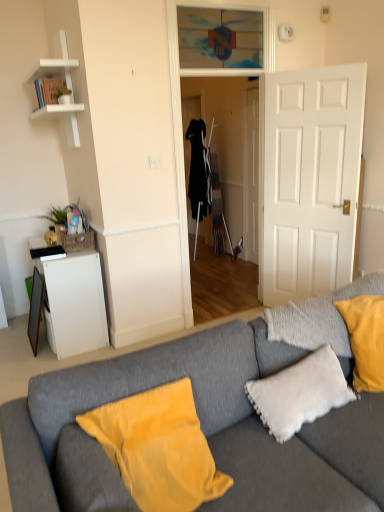
Question: Is transparent glass door at center to the left of transparent glass door at upper center from the viewer's perspective?

Choices:
 (A) no
 (B) yes

Answer: (A)

Question: From the image's perspective, is transparent glass door at center over transparent glass door at upper center?

Choices:
 (A) yes
 (B) no

Answer: (B)

Question: Is transparent glass door at center wider than transparent glass door at upper center?

Choices:
 (A) no
 (B) yes

Answer: (B)

Question: Is transparent glass door at center bigger than transparent glass door at upper center?

Choices:
 (A) no
 (B) yes

Answer: (B)

Question: Can you confirm if transparent glass door at center is smaller than transparent glass door at upper center?

Choices:
 (A) yes
 (B) no

Answer: (B)

Question: Would you say green leafy plant at upper left is inside or outside white fluffy pillow at lower right, acting as the 1th pillow starting from the right?

Choices:
 (A) inside
 (B) outside

Answer: (B)

Question: Is point (64, 96) positioned closer to the camera than point (296, 389)?

Choices:
 (A) farther
 (B) closer

Answer: (A)

Question: Considering the relative positions of green leafy plant at upper left and white fluffy pillow at lower right, acting as the second pillow starting from the left, in the image provided, is green leafy plant at upper left to the left or to the right of white fluffy pillow at lower right, acting as the second pillow starting from the left,?

Choices:
 (A) left
 (B) right

Answer: (A)

Question: From the image's perspective, is green leafy plant at upper left located above or below white fluffy pillow at lower right, acting as the 1th pillow starting from the right?

Choices:
 (A) above
 (B) below

Answer: (A)

Question: Is white matte cabinet at left wider or thinner than white fluffy pillow at lower right, acting as the 1th pillow starting from the right?

Choices:
 (A) thin
 (B) wide

Answer: (B)

Question: Visually, is white matte cabinet at left positioned to the left or to the right of white fluffy pillow at lower right, acting as the 1th pillow starting from the right?

Choices:
 (A) right
 (B) left

Answer: (B)

Question: Choose the correct answer: Is white matte cabinet at left inside white fluffy pillow at lower right, acting as the 1th pillow starting from the right, or outside it?

Choices:
 (A) inside
 (B) outside

Answer: (B)

Question: Is point (74, 307) closer or farther from the camera than point (337, 376)?

Choices:
 (A) farther
 (B) closer

Answer: (A)

Question: Considering the positions of gray fabric couch at center and transparent glass door at upper center in the image, is gray fabric couch at center wider or thinner than transparent glass door at upper center?

Choices:
 (A) thin
 (B) wide

Answer: (B)

Question: In the image, is gray fabric couch at center positioned in front of or behind transparent glass door at upper center?

Choices:
 (A) behind
 (B) front

Answer: (B)